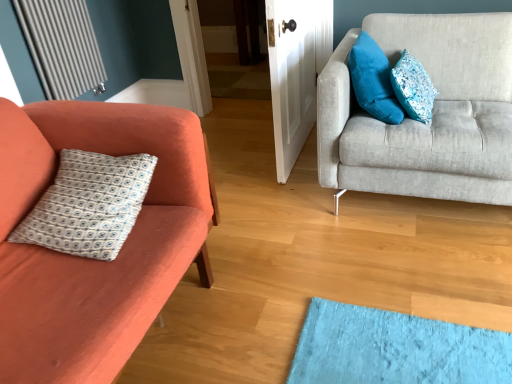
What do you see at coordinates (95, 260) in the screenshot? The height and width of the screenshot is (384, 512). I see `matte orange couch at left, arranged as the 1th studio couch when viewed from the left` at bounding box center [95, 260].

Where is `matte orange couch at left, arranged as the 1th studio couch when viewed from the left`? matte orange couch at left, arranged as the 1th studio couch when viewed from the left is located at coordinates (95, 260).

Describe the element at coordinates (89, 204) in the screenshot. I see `white printed fabric pillow at left, the first pillow in the left-to-right sequence` at that location.

What do you see at coordinates (373, 81) in the screenshot?
I see `velvety blue pillow at upper right, which ranks as the second pillow in right-to-left order` at bounding box center [373, 81].

What is the approximate height of velvety blue pillow at upper right, which is counted as the 2th pillow, starting from the left?

velvety blue pillow at upper right, which is counted as the 2th pillow, starting from the left, is 33.04 centimeters in height.

Where is `white glossy door at center`? The width and height of the screenshot is (512, 384). white glossy door at center is located at coordinates (296, 71).

Where is `blue textured pillow at upper right, the 1th pillow from the right`? The height and width of the screenshot is (384, 512). blue textured pillow at upper right, the 1th pillow from the right is located at coordinates (413, 88).

I want to click on matte orange couch at left, marked as the 2th studio couch in a right-to-left arrangement, so click(95, 260).

Is blue textured pillow at upper right, the 1th pillow from the right, located outside white glossy door at center?

blue textured pillow at upper right, the 1th pillow from the right, is positioned outside white glossy door at center.

Is blue textured pillow at upper right, the 1th pillow from the right, far away from white glossy door at center?

No, there isn't a large distance between blue textured pillow at upper right, the 1th pillow from the right, and white glossy door at center.

Does blue textured pillow at upper right, the 1th pillow from the right, have a larger size compared to white glossy door at center?

Actually, blue textured pillow at upper right, the 1th pillow from the right, might be smaller than white glossy door at center.

Which is farther from the camera, (x=422, y=78) or (x=286, y=165)?

Point (x=286, y=165)

Considering the relative sizes of matte orange couch at left, marked as the 2th studio couch in a right-to-left arrangement, and white printed fabric pillow at left, the first pillow in the left-to-right sequence, in the image provided, is matte orange couch at left, marked as the 2th studio couch in a right-to-left arrangement, thinner than white printed fabric pillow at left, the first pillow in the left-to-right sequence,?

No, matte orange couch at left, marked as the 2th studio couch in a right-to-left arrangement, is not thinner than white printed fabric pillow at left, the first pillow in the left-to-right sequence.

Are matte orange couch at left, arranged as the 1th studio couch when viewed from the left, and white printed fabric pillow at left, acting as the third pillow starting from the right, beside each other?

matte orange couch at left, arranged as the 1th studio couch when viewed from the left, and white printed fabric pillow at left, acting as the third pillow starting from the right, are not in contact.

Is matte orange couch at left, arranged as the 1th studio couch when viewed from the left, oriented towards white printed fabric pillow at left, acting as the third pillow starting from the right?

Yes, matte orange couch at left, arranged as the 1th studio couch when viewed from the left, faces towards white printed fabric pillow at left, acting as the third pillow starting from the right.

Is velvety blue pillow at upper right, which ranks as the second pillow in right-to-left order, at the back of white glossy door at center?

Correct, white glossy door at center is looking away from velvety blue pillow at upper right, which ranks as the second pillow in right-to-left order.

Which is correct: white glossy door at center is inside velvety blue pillow at upper right, which is counted as the 2th pillow, starting from the left, or outside of it?

The correct answer is: outside.

Between white glossy door at center and velvety blue pillow at upper right, which ranks as the second pillow in right-to-left order, which one has more height?

white glossy door at center is taller.

In the image, is white glossy door at center positioned in front of or behind velvety blue pillow at upper right, which is counted as the 2th pillow, starting from the left?

white glossy door at center is positioned farther from the viewer than velvety blue pillow at upper right, which is counted as the 2th pillow, starting from the left.

Is matte orange couch at left, arranged as the 1th studio couch when viewed from the left, facing towards white glossy door at center?

No, matte orange couch at left, arranged as the 1th studio couch when viewed from the left, is not facing towards white glossy door at center.

Does point (61, 329) lie in front of point (320, 66)?

Yes, it is.

Is matte orange couch at left, arranged as the 1th studio couch when viewed from the left, directly adjacent to white glossy door at center?

There is a gap between matte orange couch at left, arranged as the 1th studio couch when viewed from the left, and white glossy door at center.

Consider the image. Considering the sizes of matte orange couch at left, marked as the 2th studio couch in a right-to-left arrangement, and white glossy door at center in the image, is matte orange couch at left, marked as the 2th studio couch in a right-to-left arrangement, bigger or smaller than white glossy door at center?

In the image, matte orange couch at left, marked as the 2th studio couch in a right-to-left arrangement, appears to be larger than white glossy door at center.

Is white printed fabric pillow at left, acting as the third pillow starting from the right, in contact with blue textured pillow at upper right, placed as the third pillow when sorted from left to right?

No, white printed fabric pillow at left, acting as the third pillow starting from the right, is not in contact with blue textured pillow at upper right, placed as the third pillow when sorted from left to right.

Which is nearer, (x=46, y=193) or (x=419, y=103)?

Point (x=46, y=193) is closer to the camera than point (x=419, y=103).

Is white printed fabric pillow at left, the first pillow in the left-to-right sequence, facing away from blue textured pillow at upper right, placed as the third pillow when sorted from left to right?

No, blue textured pillow at upper right, placed as the third pillow when sorted from left to right, is not at the back of white printed fabric pillow at left, the first pillow in the left-to-right sequence.

Which is nearer, (50, 32) or (388, 64)?

Point (50, 32) is farther from the camera than point (388, 64).

Looking at the image, does metallic silver radiator at upper left seem bigger or smaller compared to velvety blue pillow at upper right, which ranks as the second pillow in right-to-left order?

In the image, metallic silver radiator at upper left appears to be smaller than velvety blue pillow at upper right, which ranks as the second pillow in right-to-left order.

Between metallic silver radiator at upper left and velvety blue pillow at upper right, which ranks as the second pillow in right-to-left order, which one has more height?

With more height is metallic silver radiator at upper left.

Can you confirm if white glossy door at center is positioned to the left of light gray fabric couch at right, acting as the first studio couch starting from the right?

Yes.

From the image's perspective, which is below, white glossy door at center or light gray fabric couch at right, acting as the first studio couch starting from the right?

light gray fabric couch at right, acting as the first studio couch starting from the right, is shown below in the image.

From a real-world perspective, is white glossy door at center physically above light gray fabric couch at right, acting as the first studio couch starting from the right?

Indeed, from a real-world perspective, white glossy door at center stands above light gray fabric couch at right, acting as the first studio couch starting from the right.

Is white glossy door at center touching light gray fabric couch at right, acting as the first studio couch starting from the right?

There is a gap between white glossy door at center and light gray fabric couch at right, acting as the first studio couch starting from the right.

Identify the location of door above the blue textured pillow at upper right, the 1th pillow from the right (from the image's perspective). This screenshot has width=512, height=384. (296, 71).

Locate an element on the screen. This screenshot has width=512, height=384. pillow that is the 1st one when counting rightward from the matte orange couch at left, marked as the 2th studio couch in a right-to-left arrangement is located at coordinates (89, 204).

Looking at the image, which one is located closer to matte orange couch at left, marked as the 2th studio couch in a right-to-left arrangement, blue textured pillow at upper right, the 1th pillow from the right, or light gray fabric couch at right, acting as the first studio couch starting from the right?

light gray fabric couch at right, acting as the first studio couch starting from the right, is positioned closer to the anchor matte orange couch at left, marked as the 2th studio couch in a right-to-left arrangement.

When comparing their distances from velvety blue pillow at upper right, which is counted as the 2th pillow, starting from the left, does white printed fabric pillow at left, acting as the third pillow starting from the right, or metallic silver radiator at upper left seem closer?

white printed fabric pillow at left, acting as the third pillow starting from the right, is closer to velvety blue pillow at upper right, which is counted as the 2th pillow, starting from the left.

Based on their spatial positions, is velvety blue pillow at upper right, which is counted as the 2th pillow, starting from the left, or light gray fabric couch at right, acting as the first studio couch starting from the right, further from metallic silver radiator at upper left?

The object further to metallic silver radiator at upper left is light gray fabric couch at right, acting as the first studio couch starting from the right.

Estimate the real-world distances between objects in this image. Which object is further from white glossy door at center, light gray fabric couch at right, acting as the first studio couch starting from the right, or matte orange couch at left, marked as the 2th studio couch in a right-to-left arrangement?

matte orange couch at left, marked as the 2th studio couch in a right-to-left arrangement.

When comparing their distances from white printed fabric pillow at left, acting as the third pillow starting from the right, does metallic silver radiator at upper left or matte orange couch at left, arranged as the 1th studio couch when viewed from the left, seem closer?

matte orange couch at left, arranged as the 1th studio couch when viewed from the left, is closer to white printed fabric pillow at left, acting as the third pillow starting from the right.

Which object lies further to the anchor point white glossy door at center, metallic silver radiator at upper left or light gray fabric couch at right, which appears as the second studio couch when viewed from the left?

metallic silver radiator at upper left is further to white glossy door at center.

Considering their positions, is metallic silver radiator at upper left positioned closer to blue textured pillow at upper right, the 1th pillow from the right, than light gray fabric couch at right, which appears as the second studio couch when viewed from the left?

light gray fabric couch at right, which appears as the second studio couch when viewed from the left.

Looking at the image, which one is located closer to white glossy door at center, blue textured pillow at upper right, the 1th pillow from the right, or matte orange couch at left, arranged as the 1th studio couch when viewed from the left?

Based on the image, blue textured pillow at upper right, the 1th pillow from the right, appears to be nearer to white glossy door at center.

The image size is (512, 384). Find the location of `door between white printed fabric pillow at left, the first pillow in the left-to-right sequence, and blue textured pillow at upper right, placed as the third pillow when sorted from left to right, from left to right`. door between white printed fabric pillow at left, the first pillow in the left-to-right sequence, and blue textured pillow at upper right, placed as the third pillow when sorted from left to right, from left to right is located at coordinates (296, 71).

Find the location of `door between matte orange couch at left, arranged as the 1th studio couch when viewed from the left, and metallic silver radiator at upper left from front to back`. door between matte orange couch at left, arranged as the 1th studio couch when viewed from the left, and metallic silver radiator at upper left from front to back is located at coordinates pyautogui.click(x=296, y=71).

Image resolution: width=512 pixels, height=384 pixels. I want to click on door between matte orange couch at left, marked as the 2th studio couch in a right-to-left arrangement, and light gray fabric couch at right, acting as the first studio couch starting from the right, from left to right, so click(x=296, y=71).

At what (x,y) coordinates should I click in order to perform the action: click on pillow located between white printed fabric pillow at left, acting as the third pillow starting from the right, and blue textured pillow at upper right, placed as the third pillow when sorted from left to right, in the left-right direction. Please return your answer as a coordinate pair (x, y). The width and height of the screenshot is (512, 384). Looking at the image, I should click on (373, 81).